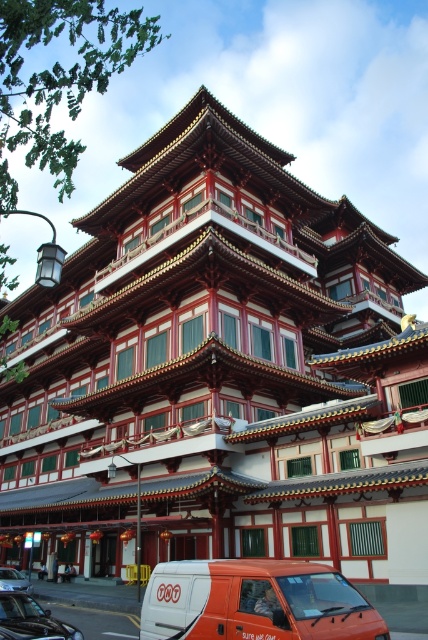
Question: Does orange matte van at lower center come in front of shiny black car at lower left?

Choices:
 (A) yes
 (B) no

Answer: (A)

Question: Estimate the real-world distances between objects in this image. Which object is closer to the metallic silver van at lower left?

Choices:
 (A) shiny black car at lower left
 (B) orange matte van at lower center

Answer: (A)

Question: Can you confirm if shiny black car at lower left is positioned to the right of metallic silver van at lower left?

Choices:
 (A) no
 (B) yes

Answer: (B)

Question: Which object is the farthest from the shiny black car at lower left?

Choices:
 (A) metallic silver van at lower left
 (B) orange matte van at lower center

Answer: (A)

Question: Among these points, which one is nearest to the camera?

Choices:
 (A) (234, 588)
 (B) (11, 612)
 (C) (23, 586)

Answer: (A)

Question: Is orange matte van at lower center further to camera compared to metallic silver van at lower left?

Choices:
 (A) yes
 (B) no

Answer: (B)